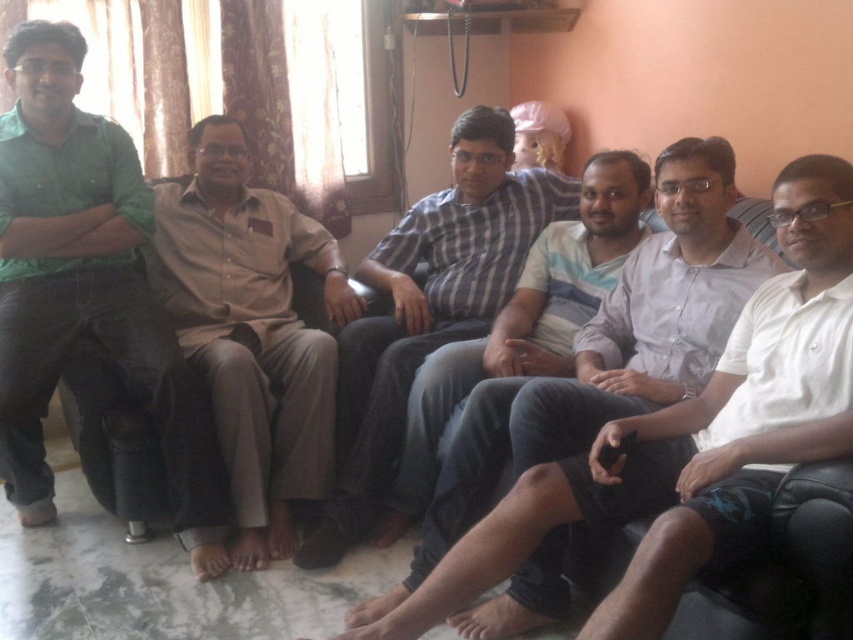
Between point (105, 337) and point (341, 320), which one is positioned behind?

The point (341, 320) is more distant.

Between point (195, 388) and point (285, 328), which one is positioned behind?

Point (285, 328)

Locate an element on the screen. The height and width of the screenshot is (640, 853). green matte shirt at left is located at coordinates (85, 285).

Which of these two, green matte shirt at left or striped cotton shirt at center, stands taller?

green matte shirt at left

Identify the location of green matte shirt at left. (85, 285).

Is the position of beige cotton shirt at center more distant than that of striped cotton shirt at center?

Yes, it is behind striped cotton shirt at center.

Does beige cotton shirt at center appear on the right side of striped cotton shirt at center?

No, beige cotton shirt at center is not to the right of striped cotton shirt at center.

The width and height of the screenshot is (853, 640). I want to click on beige cotton shirt at center, so click(x=252, y=332).